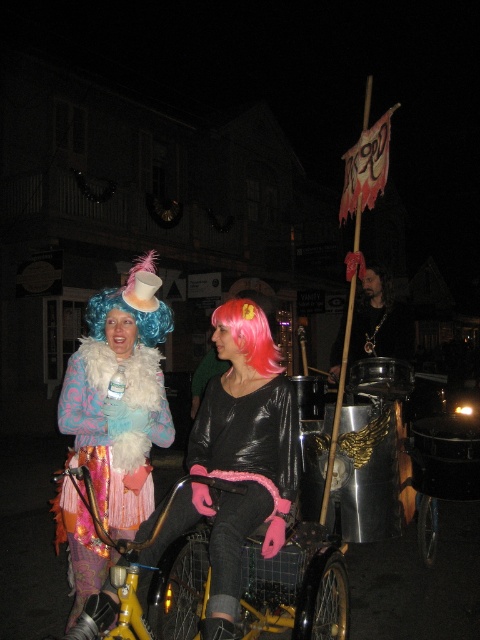
Is glossy black jacket at center wider than black matte hair at upper right?

Indeed, glossy black jacket at center has a greater width compared to black matte hair at upper right.

Measure the distance between glossy black jacket at center and black matte hair at upper right.

They are 2.25 meters apart.

Does point (228, 496) lie in front of point (362, 284)?

Yes, it is in front of point (362, 284).

Find the location of a particular element. glossy black jacket at center is located at coordinates (238, 458).

How far apart are shiny blue wig at center and yellow metallic bicycle at center?

The distance of shiny blue wig at center from yellow metallic bicycle at center is 19.70 inches.

Can you confirm if shiny blue wig at center is smaller than yellow metallic bicycle at center?

Yes, shiny blue wig at center is smaller than yellow metallic bicycle at center.

Does point (97, 316) lie in front of point (253, 616)?

Yes.

Find the location of a particular element. The image size is (480, 640). shiny blue wig at center is located at coordinates (120, 396).

Is point (92, 440) positioned before point (152, 340)?

Yes, point (92, 440) is in front of point (152, 340).

Which is behind, point (121, 353) or point (140, 310)?

The point (121, 353) is behind.

Image resolution: width=480 pixels, height=640 pixels. In order to click on shiny blue wig at center in this screenshot , I will do `click(120, 396)`.